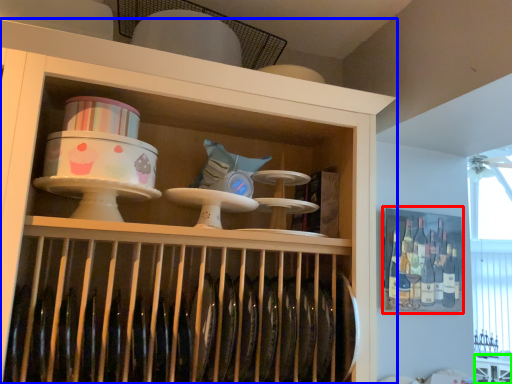
Question: Which object is positioned closest to cabinet (highlighted by a red box)? Select from shelf (highlighted by a blue box) and table (highlighted by a green box).

Choices:
 (A) shelf
 (B) table

Answer: (B)